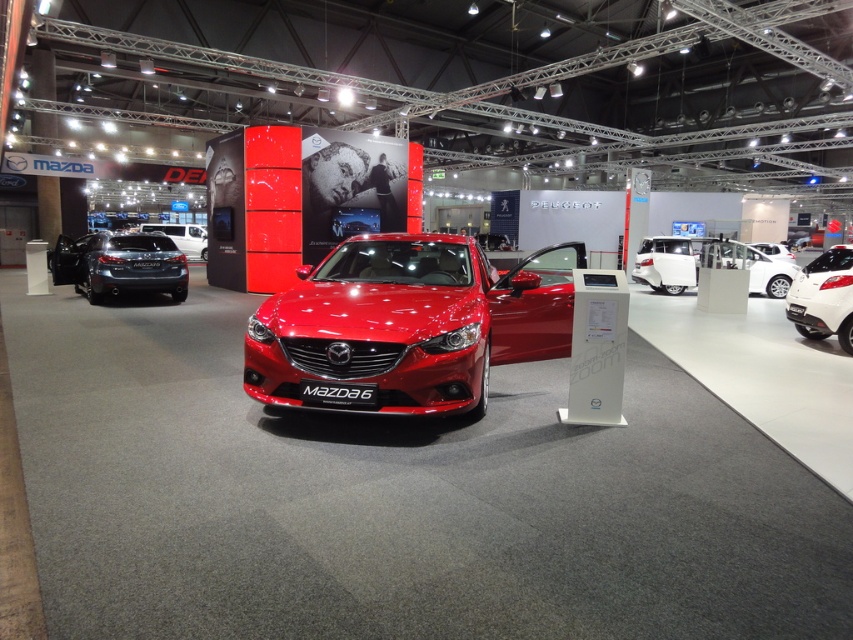
Who is taller, matte black hatchback at left or satin white sedan at center?

With more height is matte black hatchback at left.

Can you confirm if matte black hatchback at left is shorter than satin white sedan at center?

No.

Between point (160, 256) and point (173, 241), which one is positioned in front?

Point (160, 256) is in front.

Locate an element on the screen. The width and height of the screenshot is (853, 640). matte black hatchback at left is located at coordinates (119, 264).

Does glossy red car at center come behind satin silver car at center?

That is False.

Where is `glossy red car at center`? glossy red car at center is located at coordinates (407, 324).

In order to click on glossy red car at center in this screenshot , I will do `click(407, 324)`.

Who is lower down, white glossy car at right or satin silver car at center?

white glossy car at right

Is white glossy car at right wider than satin silver car at center?

Incorrect, white glossy car at right's width does not surpass satin silver car at center's.

Which is behind, point (825, 314) or point (734, 252)?

Positioned behind is point (734, 252).

Where is `white glossy car at right`? This screenshot has height=640, width=853. white glossy car at right is located at coordinates (822, 298).